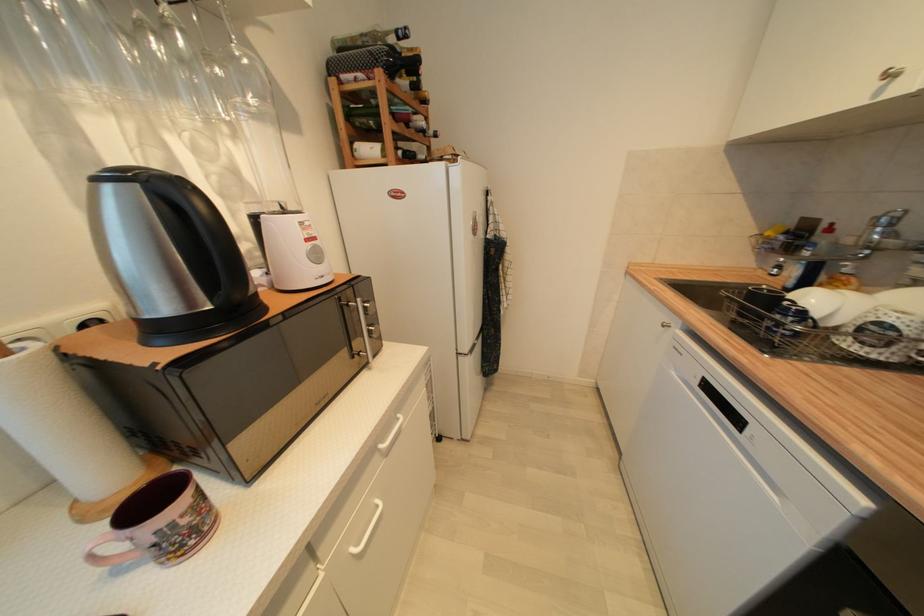
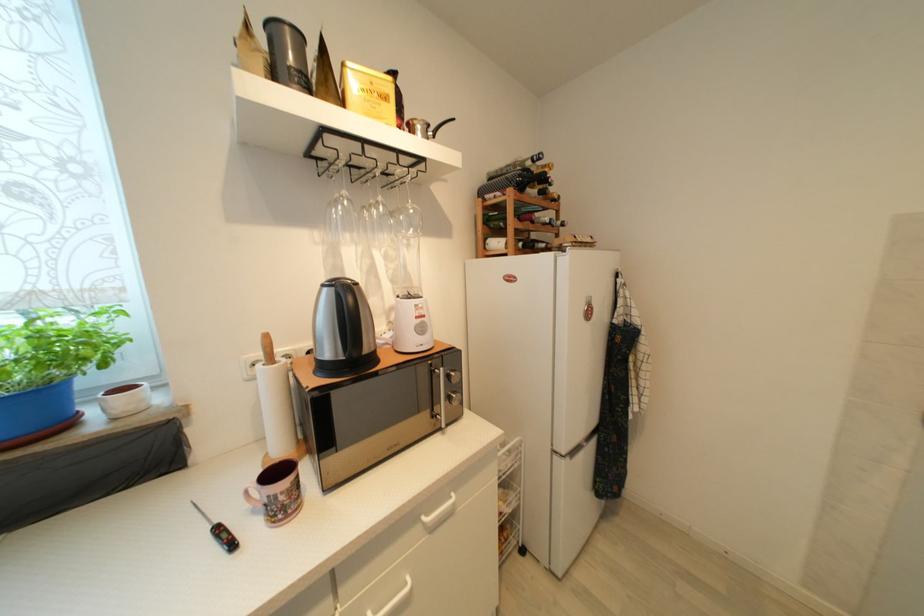
Where in the second image is the point corresponding to pixel 235 146 from the first image?

(409, 253)